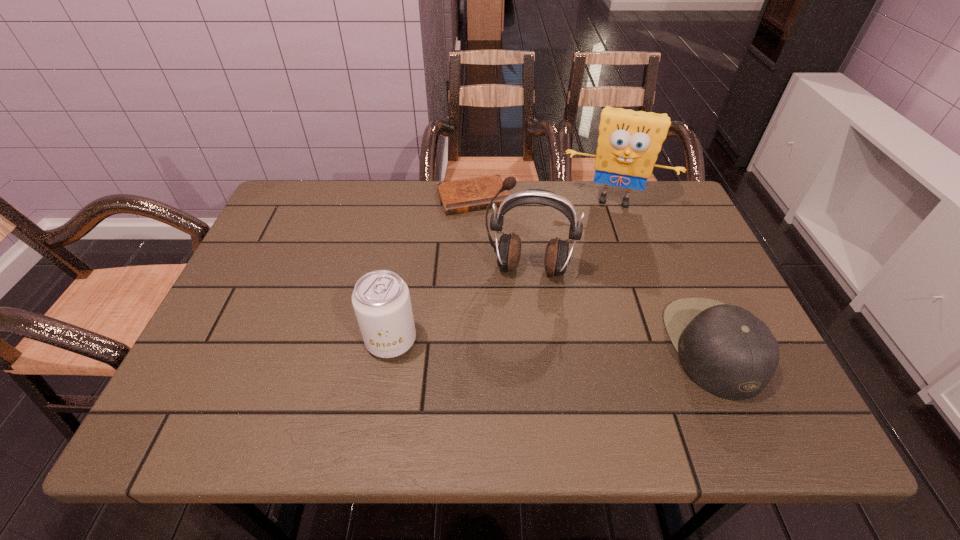
Locate an element on the screen. The image size is (960, 540). vacant space on the desktop that is between the third shortest object and the cap and is positioned on the spine side of the diary is located at coordinates (536, 343).

Locate an element on the screen. This screenshot has height=540, width=960. free space on the desktop that is between the third shortest object and the cap and is positioned on the ear pads of the third nearest object is located at coordinates (519, 342).

You are a GUI agent. You are given a task and a screenshot of the screen. Output one action in this format:
    pyautogui.click(x=<x>, y=<y>)
    Task: Click on the vacant space on the desktop that is between the third shortest object and the second shortest object and is positioned on the face of the sponge
    
    Given the screenshot: What is the action you would take?
    pyautogui.click(x=588, y=344)